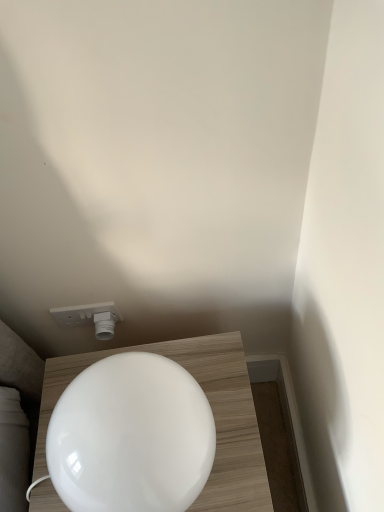
Question: Does point (62, 480) appear closer or farther from the camera than point (99, 336)?

Choices:
 (A) closer
 (B) farther

Answer: (A)

Question: From a real-world perspective, is white glossy toilet at lower center positioned above or below white plastic socket at upper center?

Choices:
 (A) below
 (B) above

Answer: (B)

Question: From the image's perspective, relative to white plastic socket at upper center, is white glossy toilet at lower center above or below?

Choices:
 (A) below
 (B) above

Answer: (A)

Question: From a real-world perspective, is white plastic socket at upper center physically located above or below white glossy toilet at lower center?

Choices:
 (A) below
 (B) above

Answer: (A)

Question: Is white plastic socket at upper center taller or shorter than white glossy toilet at lower center?

Choices:
 (A) short
 (B) tall

Answer: (A)

Question: Is white plastic socket at upper center in front of or behind white glossy toilet at lower center in the image?

Choices:
 (A) behind
 (B) front

Answer: (A)

Question: Is white plastic socket at upper center situated inside white glossy toilet at lower center or outside?

Choices:
 (A) inside
 (B) outside

Answer: (B)